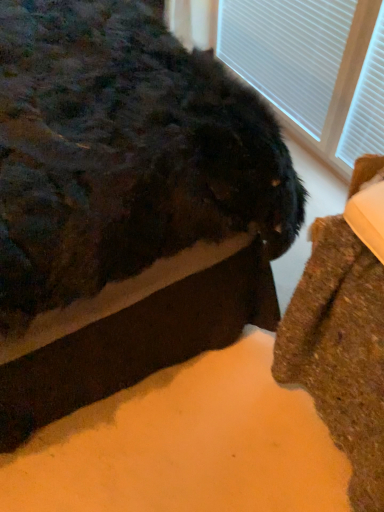
Identify the location of vacant area to the left of brown textured rug at lower right. (208, 430).